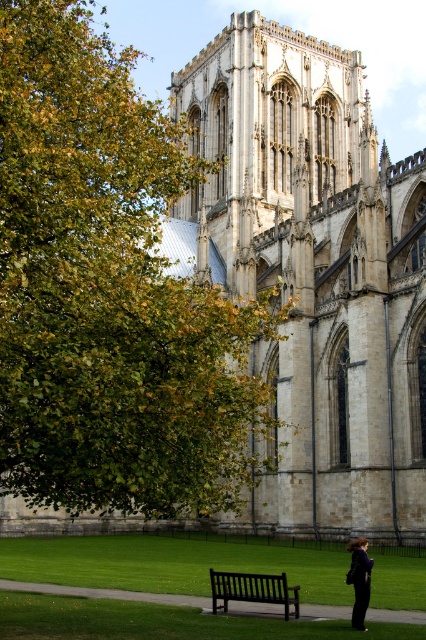
Question: Which object is farther from the camera taking this photo?

Choices:
 (A) green leafy tree at left
 (B) black wooden bench at lower center
 (C) dark blue fabric coat at lower right
 (D) stone gothic cathedral at center

Answer: (D)

Question: Where is green leafy tree at left located in relation to dark blue fabric coat at lower right in the image?

Choices:
 (A) left
 (B) right

Answer: (A)

Question: Which object is the farthest from the dark blue fabric coat at lower right?

Choices:
 (A) black wooden bench at lower center
 (B) stone gothic cathedral at center
 (C) green leafy tree at left

Answer: (B)

Question: Among these objects, which one is farthest from the camera?

Choices:
 (A) stone gothic cathedral at center
 (B) green leafy tree at left
 (C) black wooden bench at lower center

Answer: (A)

Question: In this image, where is green leafy tree at left located relative to black wooden bench at lower center?

Choices:
 (A) below
 (B) above

Answer: (B)

Question: Can you confirm if green leafy tree at left is smaller than stone gothic cathedral at center?

Choices:
 (A) no
 (B) yes

Answer: (A)